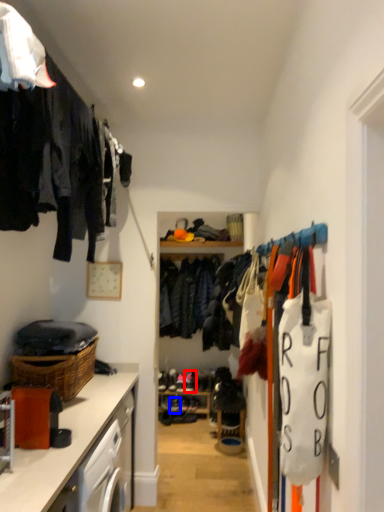
Question: Which of the following is the farthest to the observer, shoe (highlighted by a red box) or shoe (highlighted by a blue box)?

Choices:
 (A) shoe
 (B) shoe

Answer: (A)